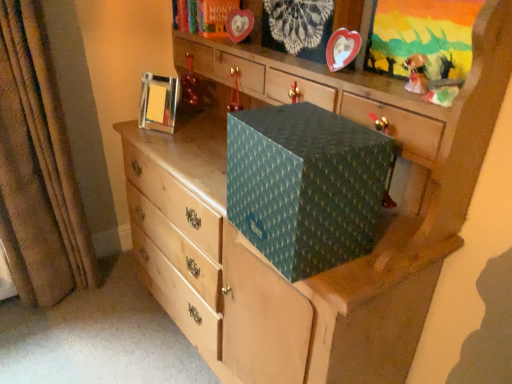
Locate an element on the screen. The image size is (512, 384). brown textured curtain at left is located at coordinates (38, 168).

Where is `teal textured box at center`? The width and height of the screenshot is (512, 384). teal textured box at center is located at coordinates (306, 185).

At what (x,y) coordinates should I click in order to perform the action: click on metallic heart-shaped frame at upper center, which is counted as the 2th picture frame, starting from the left. Please return your answer as a coordinate pair (x, y). Image resolution: width=512 pixels, height=384 pixels. Looking at the image, I should click on (342, 48).

Where is `brown textured curtain at left`? brown textured curtain at left is located at coordinates (38, 168).

From a real-world perspective, is shiny gold figurine at upper right, the 2th toy positioned from the left, above or below metallic silver picture frame at upper left, the 1th picture frame positioned from the left?

Clearly, from a real-world perspective, shiny gold figurine at upper right, the 2th toy positioned from the left, is above metallic silver picture frame at upper left, the 1th picture frame positioned from the left.

Which picture frame is the 2nd one when counting from the back of the shiny gold figurine at upper right, the 2th toy positioned from the left? Please provide its 2D coordinates.

[(159, 102)]

Considering the positions of objects shiny gold figurine at upper right, the 2th toy positioned from the left, and metallic silver picture frame at upper left, the second picture frame from the right, in the image provided, who is more to the left, shiny gold figurine at upper right, the 2th toy positioned from the left, or metallic silver picture frame at upper left, the second picture frame from the right,?

metallic silver picture frame at upper left, the second picture frame from the right.

Which is in front, shiny gold figurine at upper right, the 2th toy positioned from the left, or metallic silver picture frame at upper left, which is counted as the second picture frame, starting from the front?

shiny gold figurine at upper right, the 2th toy positioned from the left.

Between metallic silver picture frame at upper left, the 1th picture frame positioned from the left, and metallic red ornament at upper center, placed as the first toy when sorted from back to front, which one appears on the right side from the viewer's perspective?

metallic red ornament at upper center, placed as the first toy when sorted from back to front, is more to the right.

Is metallic silver picture frame at upper left, which is the first picture frame in back-to-front order, situated inside metallic red ornament at upper center, placed as the second toy when sorted from bottom to top, or outside?

metallic silver picture frame at upper left, which is the first picture frame in back-to-front order, cannot be found inside metallic red ornament at upper center, placed as the second toy when sorted from bottom to top.

Considering the relative sizes of metallic silver picture frame at upper left, the 1th picture frame positioned from the left, and metallic red ornament at upper center, which is the 2th toy from right to left, in the image provided, is metallic silver picture frame at upper left, the 1th picture frame positioned from the left, thinner than metallic red ornament at upper center, which is the 2th toy from right to left,?

No.

Considering the points (187, 82) and (256, 115), which point is behind, point (187, 82) or point (256, 115)?

The point (187, 82) is more distant.

In the scene shown: Is metallic red ornament at upper center, the 1th toy positioned from the left, positioned with its back to teal textured box at center?

metallic red ornament at upper center, the 1th toy positioned from the left, is not turned away from teal textured box at center.

You are a GUI agent. You are given a task and a screenshot of the screen. Output one action in this format:
    pyautogui.click(x=<x>, y=<y>)
    Task: Click on the cardboard box in front of the metallic red ornament at upper center, the 1th toy positioned from the top
    
    Given the screenshot: What is the action you would take?
    pyautogui.click(x=306, y=185)

How many degrees apart are the facing directions of metallic heart-shaped frame at upper center, which appears as the 1th picture frame when viewed from the front, and metallic red ornament at upper center, which is the 2th toy from right to left?

The facing directions of metallic heart-shaped frame at upper center, which appears as the 1th picture frame when viewed from the front, and metallic red ornament at upper center, which is the 2th toy from right to left, are 0.317 degrees apart.

Is point (331, 47) in front of point (189, 78)?

Yes, it is.

Is metallic heart-shaped frame at upper center, which appears as the 1th picture frame when viewed from the front, to the left of metallic red ornament at upper center, placed as the first toy when sorted from back to front, from the viewer's perspective?

No.

Is metallic heart-shaped frame at upper center, the first picture frame viewed from the right, facing towards metallic red ornament at upper center, placed as the first toy when sorted from back to front?

No, metallic heart-shaped frame at upper center, the first picture frame viewed from the right, is not aimed at metallic red ornament at upper center, placed as the first toy when sorted from back to front.

Does teal textured box at center touch brown textured curtain at left?

No, teal textured box at center is not next to brown textured curtain at left.

Is brown textured curtain at left completely or partially inside teal textured box at center?

No, brown textured curtain at left is located outside of teal textured box at center.

From a real-world perspective, is teal textured box at center below brown textured curtain at left?

No, from a real-world perspective, teal textured box at center is not beneath brown textured curtain at left.

How far apart are teal textured box at center and brown textured curtain at left?

3.69 feet.

Considering the relative sizes of metallic heart-shaped frame at upper center, positioned as the second picture frame in back-to-front order, and metallic silver picture frame at upper left, which is counted as the second picture frame, starting from the front, in the image provided, is metallic heart-shaped frame at upper center, positioned as the second picture frame in back-to-front order, thinner than metallic silver picture frame at upper left, which is counted as the second picture frame, starting from the front,?

Yes, metallic heart-shaped frame at upper center, positioned as the second picture frame in back-to-front order, is thinner than metallic silver picture frame at upper left, which is counted as the second picture frame, starting from the front.

Looking at this image, which of these two, metallic heart-shaped frame at upper center, which appears as the 1th picture frame when viewed from the front, or metallic silver picture frame at upper left, the second picture frame from the right, stands taller?

Standing taller between the two is metallic silver picture frame at upper left, the second picture frame from the right.

Based on the photo, considering the sizes of metallic heart-shaped frame at upper center, the first picture frame viewed from the right, and metallic silver picture frame at upper left, the 1th picture frame positioned from the left, in the image, is metallic heart-shaped frame at upper center, the first picture frame viewed from the right, bigger or smaller than metallic silver picture frame at upper left, the 1th picture frame positioned from the left,?

Considering their sizes, metallic heart-shaped frame at upper center, the first picture frame viewed from the right, takes up less space than metallic silver picture frame at upper left, the 1th picture frame positioned from the left.

Who is more distant, metallic heart-shaped frame at upper center, the first picture frame viewed from the right, or metallic silver picture frame at upper left, the 1th picture frame positioned from the left?

Positioned behind is metallic silver picture frame at upper left, the 1th picture frame positioned from the left.

Is metallic heart-shaped frame at upper center, the first picture frame viewed from the right, facing towards brown textured curtain at left?

No, metallic heart-shaped frame at upper center, the first picture frame viewed from the right, is not aimed at brown textured curtain at left.

Is metallic heart-shaped frame at upper center, which is counted as the 2th picture frame, starting from the left, surrounding brown textured curtain at left?

No.

Is metallic heart-shaped frame at upper center, which appears as the 1th picture frame when viewed from the front, not close to brown textured curtain at left?

Yes, metallic heart-shaped frame at upper center, which appears as the 1th picture frame when viewed from the front, and brown textured curtain at left are located far from each other.

Which of these two, metallic heart-shaped frame at upper center, which is counted as the 2th picture frame, starting from the left, or brown textured curtain at left, is thinner?

With smaller width is metallic heart-shaped frame at upper center, which is counted as the 2th picture frame, starting from the left.

At what (x,y) coordinates should I click in order to perform the action: click on toy lying below the metallic silver picture frame at upper left, which is the first picture frame in back-to-front order (from the image's perspective). Please return your answer as a coordinate pair (x, y). The width and height of the screenshot is (512, 384). Looking at the image, I should click on (417, 74).

I want to click on toy that is the 1st one when counting rightward from the metallic silver picture frame at upper left, the 1th picture frame positioned from the left, so click(x=191, y=86).

Estimate the real-world distances between objects in this image. Which object is closer to shiny gold figurine at upper right, the 1th toy in the right-to-left sequence, metallic heart-shaped frame at upper center, positioned as the second picture frame in back-to-front order, or metallic silver picture frame at upper left, which is counted as the second picture frame, starting from the front?

Based on the image, metallic heart-shaped frame at upper center, positioned as the second picture frame in back-to-front order, appears to be nearer to shiny gold figurine at upper right, the 1th toy in the right-to-left sequence.

Estimate the real-world distances between objects in this image. Which object is further from shiny gold figurine at upper right, the 1th toy in the right-to-left sequence, metallic red ornament at upper center, placed as the first toy when sorted from back to front, or brown textured curtain at left?

Among the two, brown textured curtain at left is located further to shiny gold figurine at upper right, the 1th toy in the right-to-left sequence.

Looking at the image, which one is located closer to shiny gold figurine at upper right, arranged as the 2th toy when viewed from the back, metallic red ornament at upper center, the 1th toy positioned from the left, or metallic heart-shaped frame at upper center, which appears as the 1th picture frame when viewed from the front?

metallic heart-shaped frame at upper center, which appears as the 1th picture frame when viewed from the front, lies closer to shiny gold figurine at upper right, arranged as the 2th toy when viewed from the back, than the other object.

Which object lies further to the anchor point shiny gold figurine at upper right, arranged as the 2th toy when viewed from the back, teal textured box at center or brown textured curtain at left?

brown textured curtain at left.

Which object lies nearer to the anchor point brown textured curtain at left, metallic silver picture frame at upper left, which is the first picture frame in back-to-front order, or shiny gold figurine at upper right, the 1th toy in the bottom-to-top sequence?

metallic silver picture frame at upper left, which is the first picture frame in back-to-front order, is closer to brown textured curtain at left.

Looking at the image, which one is located closer to metallic heart-shaped frame at upper center, the first picture frame viewed from the right, metallic red ornament at upper center, placed as the second toy when sorted from bottom to top, or shiny gold figurine at upper right, the 1th toy in the bottom-to-top sequence?

Based on the image, shiny gold figurine at upper right, the 1th toy in the bottom-to-top sequence, appears to be nearer to metallic heart-shaped frame at upper center, the first picture frame viewed from the right.

Estimate the real-world distances between objects in this image. Which object is closer to shiny gold figurine at upper right, the second toy from the top, brown textured curtain at left or teal textured box at center?

Among the two, teal textured box at center is located nearer to shiny gold figurine at upper right, the second toy from the top.

Considering their positions, is brown textured curtain at left positioned further to metallic heart-shaped frame at upper center, positioned as the second picture frame in back-to-front order, than teal textured box at center?

The object further to metallic heart-shaped frame at upper center, positioned as the second picture frame in back-to-front order, is brown textured curtain at left.

At what (x,y) coordinates should I click in order to perform the action: click on picture frame between brown textured curtain at left and teal textured box at center from left to right. Please return your answer as a coordinate pair (x, y). Looking at the image, I should click on (159, 102).

Identify the location of toy between metallic heart-shaped frame at upper center, which appears as the 1th picture frame when viewed from the front, and teal textured box at center vertically. coord(417,74).

Identify the location of picture frame between brown textured curtain at left and metallic red ornament at upper center, the 1th toy positioned from the left. This screenshot has height=384, width=512. (159, 102).

I want to click on toy between metallic silver picture frame at upper left, the 1th picture frame positioned from the left, and metallic heart-shaped frame at upper center, positioned as the second picture frame in back-to-front order, so click(x=191, y=86).